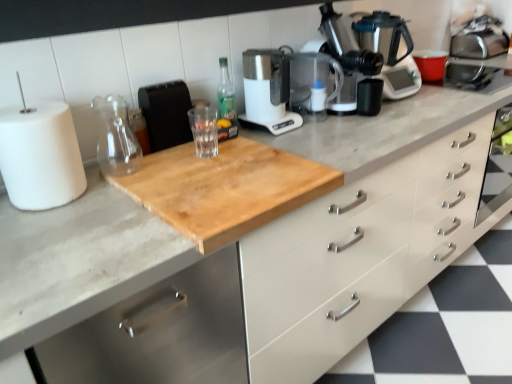
Find the location of a particular element. The image size is (512, 384). vacant space that is in between white matte paper towel at left and transparent glass jar at upper center, the 1th glass jar positioned from the left is located at coordinates (100, 174).